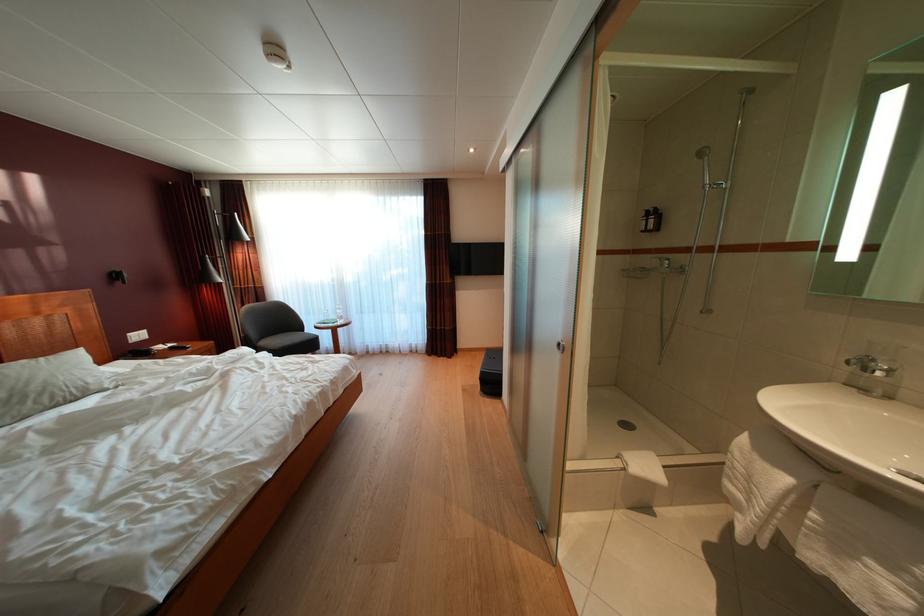
Which object does [822,524] point to?

This point indicates the white folded towel.